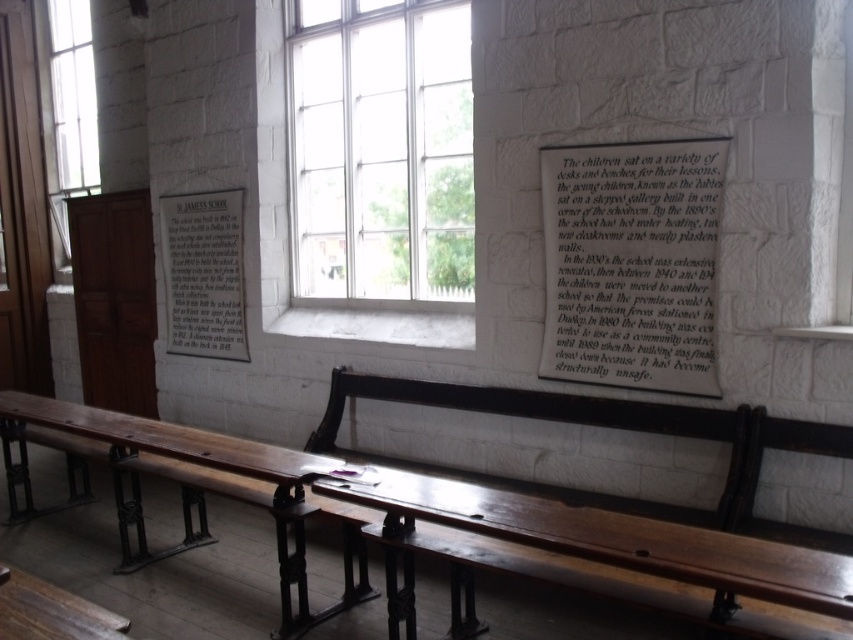
You are standing in the room and want to take a photo. There are two points in the image labeled as point (24,500) and point (218,278). Which point will appear larger in your photo?

Point (24,500) will appear larger in the photo because it is closer to the camera than point (218,278).

Looking at this image, you are an interior designer planning to hang a decorative item between the white paper at upper center and the wooden polished bench at center. Which object has a narrower width to ensure the item fits properly?

The white paper at upper center has a lesser width compared to the wooden polished bench at center, so the decorative item should be placed near the white paper at upper center to ensure it fits properly.

You are a visitor in this historical room and want to read the text on the white paper plaque at center. Where should you stand relative to the wooden polished bench at center to read it comfortably?

The wooden polished bench at center is located below the white paper plaque at center, so you should stand behind the wooden polished bench at center to read the text comfortably.